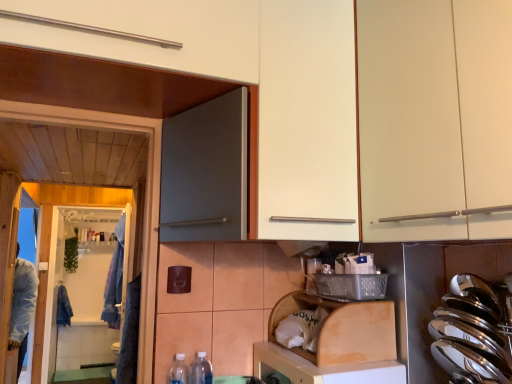
Question: Visually, is clear plastic bottle at lower center positioned to the left or to the right of white glossy screen door at lower left?

Choices:
 (A) left
 (B) right

Answer: (B)

Question: Is clear plastic bottle at lower center in front of or behind white glossy screen door at lower left in the image?

Choices:
 (A) front
 (B) behind

Answer: (A)

Question: Considering the real-world distances, which object is farthest from the wooden dishwasher at lower center, which ranks as the first dish washer in bottom-to-top order?

Choices:
 (A) polished stainless steel spoons at right
 (B) denim jacket at left, placed as the first laundry when sorted from front to back
 (C) white glossy screen door at lower left
 (D) wooden dish washer at lower center, which is the 1th dish washer in top-to-bottom order
 (E) white matte cabinet at upper right

Answer: (C)

Question: Which is farther from the wooden dish washer at lower center, the second dish washer when ordered from bottom to top?

Choices:
 (A) clear plastic bottle at lower center
 (B) white matte cabinet at upper right
 (C) wooden dishwasher at lower center, positioned as the second dish washer in top-to-bottom order
 (D) white glossy screen door at lower left
 (E) polished stainless steel spoons at right

Answer: (D)